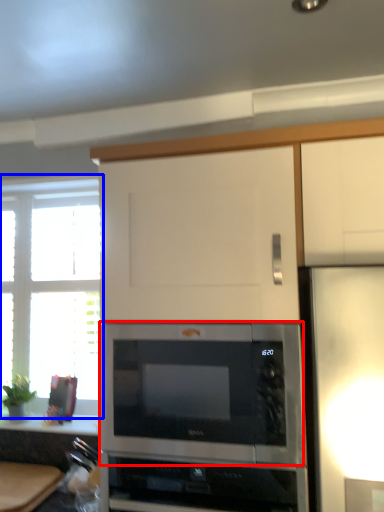
Question: Which object appears farthest to the camera in this image, microwave oven (highlighted by a red box) or window (highlighted by a blue box)?

Choices:
 (A) microwave oven
 (B) window

Answer: (B)